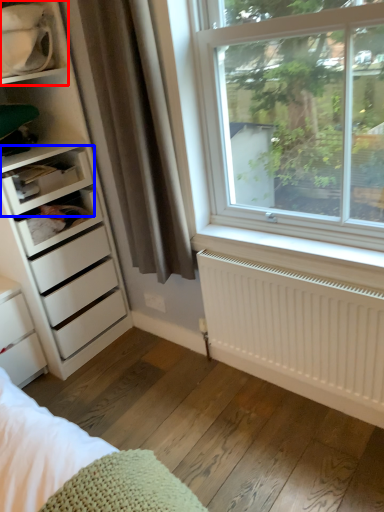
Question: Which object appears closest to the camera in this image, shelf (highlighted by a red box) or shelf (highlighted by a blue box)?

Choices:
 (A) shelf
 (B) shelf

Answer: (A)